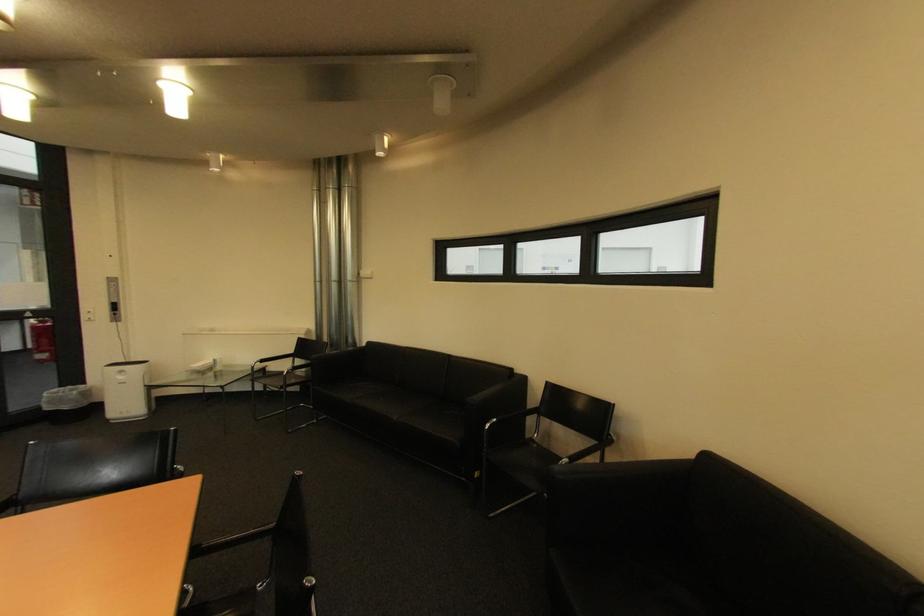
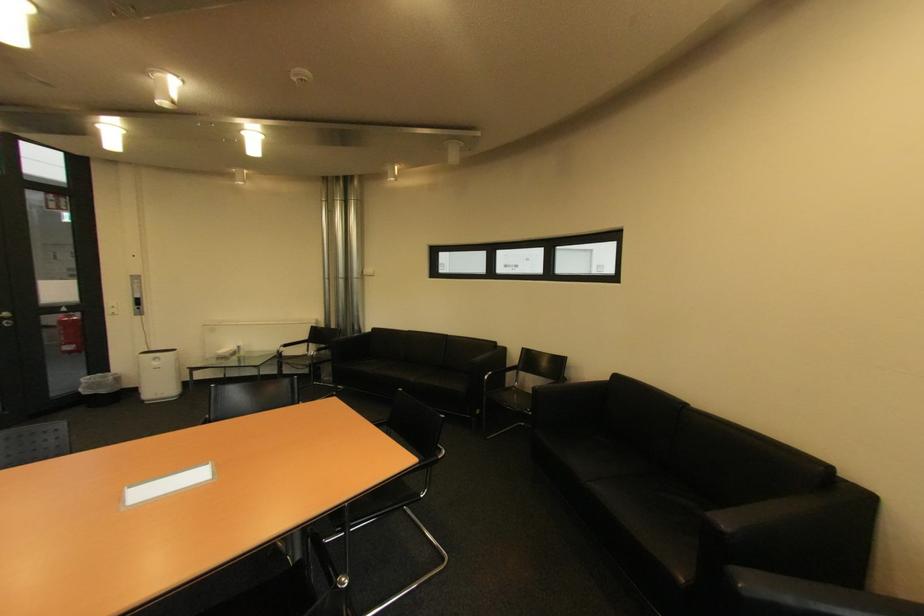
In a continuous first-person perspective shot, in which direction is the camera moving?

The movement direction of the cameraman is left, backward.